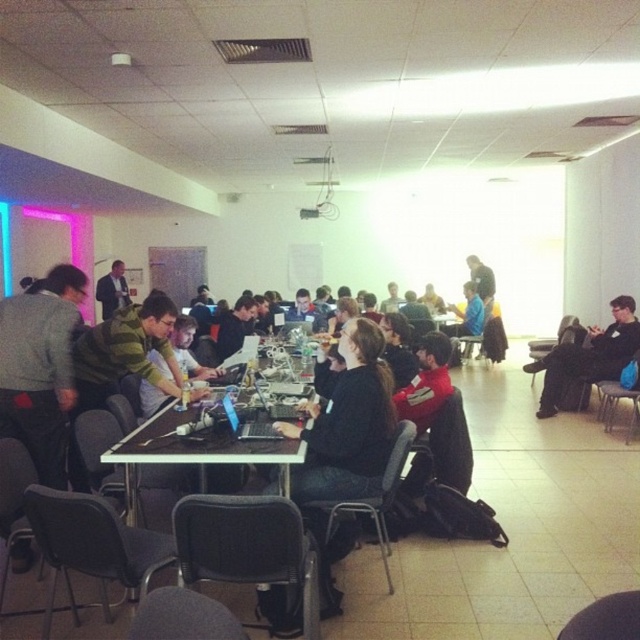
Can you confirm if black fabric chair at lower center is positioned to the right of black fabric pants at right?

No, black fabric chair at lower center is not to the right of black fabric pants at right.

Who is taller, black fabric chair at lower center or black fabric pants at right?

black fabric pants at right is taller.

Is point (280, 576) in front of point (630, 339)?

That is True.

I want to click on black fabric chair at lower center, so click(246, 547).

Does point (412, 384) come in front of point (504, 353)?

Yes, it is in front of point (504, 353).

Does point (433, 333) come farther from viewer compared to point (470, 344)?

No, (433, 333) is in front of (470, 344).

Where is `red fleece jacket at center`? Image resolution: width=640 pixels, height=640 pixels. red fleece jacket at center is located at coordinates (426, 381).

Who is more distant from viewer, (582, 342) or (445, 392)?

The point (582, 342) is behind.

Who is more distant from viewer, (557, 358) or (433, 353)?

Point (557, 358)

You are a GUI agent. You are given a task and a screenshot of the screen. Output one action in this format:
    pyautogui.click(x=<x>, y=<y>)
    Task: Click on the black fabric pants at right
    
    Given the screenshot: What is the action you would take?
    pyautogui.click(x=588, y=355)